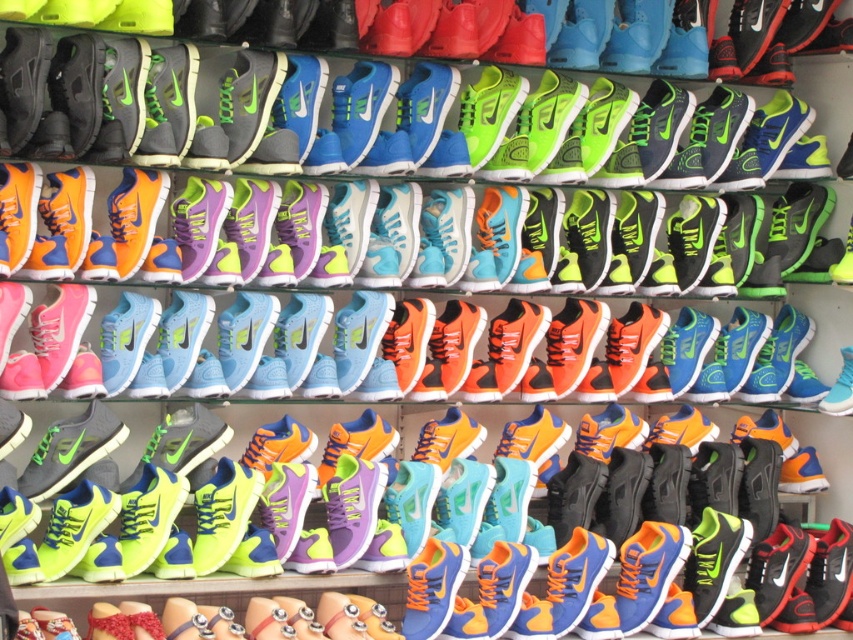
Can you confirm if matte purple sneaker at center is positioned to the right of shiny blue sneakers at center?

No, matte purple sneaker at center is not to the right of shiny blue sneakers at center.

Who is lower down, matte purple sneaker at center or shiny blue sneakers at center?

shiny blue sneakers at center is below.

Does point (663, 202) come closer to viewer compared to point (653, 337)?

Yes, point (663, 202) is closer to viewer.

You are a GUI agent. You are given a task and a screenshot of the screen. Output one action in this format:
    pyautogui.click(x=<x>, y=<y>)
    Task: Click on the matte purple sneaker at center
    Image resolution: width=853 pixels, height=640 pixels.
    Given the screenshot: What is the action you would take?
    pyautogui.click(x=438, y=237)